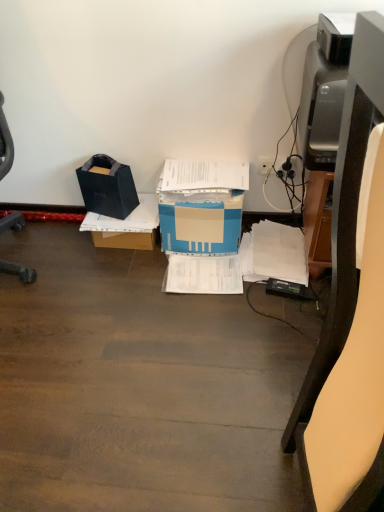
You are a GUI agent. You are given a task and a screenshot of the screen. Output one action in this format:
    pyautogui.click(x=<x>, y=<y>)
    Task: Click on the free space above white paper at lower right, marked as the first document in a right-to-left arrangement (from a real-world perspective)
    The width and height of the screenshot is (384, 512).
    Given the screenshot: What is the action you would take?
    pyautogui.click(x=278, y=246)